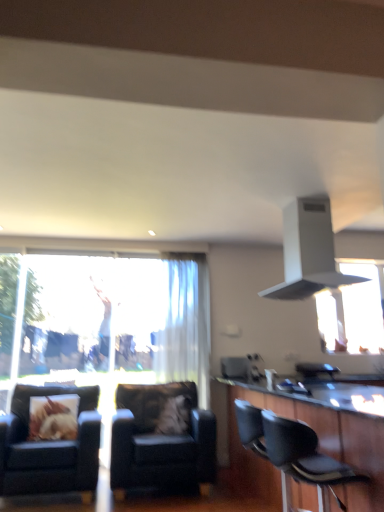
Image resolution: width=384 pixels, height=512 pixels. What are the coordinates of `white sheer curtain at center` in the screenshot? It's located at (186, 323).

In order to face fluffy fabric pillow at center, the second pillow from the left, should I rotate leftwards or rightwards?

Turn left by 2.016 degrees to look at fluffy fabric pillow at center, the second pillow from the left.

Image resolution: width=384 pixels, height=512 pixels. Identify the location of leather armchair at center, the 1th chair from the back. (161, 438).

Does point (37, 422) come farther from viewer compared to point (279, 426)?

Yes, point (37, 422) is farther from viewer.

Is printed fabric pillow at left, the second pillow positioned from the right, inside or outside of black leather chair at lower right, the first chair when ordered from front to back?

printed fabric pillow at left, the second pillow positioned from the right, is outside black leather chair at lower right, the first chair when ordered from front to back.

From the image's perspective, is printed fabric pillow at left, placed as the 1th pillow when sorted from left to right, on top of black leather chair at lower right, which is the first chair in right-to-left order?

Incorrect, from the image's perspective, printed fabric pillow at left, placed as the 1th pillow when sorted from left to right, is lower than black leather chair at lower right, which is the first chair in right-to-left order.

Considering the sizes of objects printed fabric pillow at left, placed as the 1th pillow when sorted from left to right, and white sheer curtain at center in the image provided, who is thinner, printed fabric pillow at left, placed as the 1th pillow when sorted from left to right, or white sheer curtain at center?

white sheer curtain at center is thinner.

Considering the points (47, 429) and (203, 382), which point is behind, point (47, 429) or point (203, 382)?

The point (203, 382) is farther from the camera.

From a real-world perspective, is printed fabric pillow at left, placed as the 1th pillow when sorted from left to right, above or below white sheer curtain at center?

Clearly, from a real-world perspective, printed fabric pillow at left, placed as the 1th pillow when sorted from left to right, is below white sheer curtain at center.

Is the depth of printed fabric pillow at left, placed as the 1th pillow when sorted from left to right, less than that of white sheer curtain at center?

Yes, it is in front of white sheer curtain at center.

Is white sheer curtain at center touching black leather chair at lower left, arranged as the 1th chair when viewed from the left?

No, white sheer curtain at center is not with black leather chair at lower left, arranged as the 1th chair when viewed from the left.

Based on the photo, who is taller, white sheer curtain at center or black leather chair at lower left, arranged as the 1th chair when viewed from the left?

white sheer curtain at center is taller.

Is white sheer curtain at center facing away from black leather chair at lower left, acting as the 2th chair starting from the back?

white sheer curtain at center is not turned away from black leather chair at lower left, acting as the 2th chair starting from the back.

Does point (188, 325) appear closer or farther from the camera than point (93, 436)?

Clearly, point (188, 325) is more distant from the camera than point (93, 436).

Considering the relative positions of fluffy fabric pillow at center, the 1th pillow positioned from the right, and printed fabric pillow at left, the second pillow positioned from the right, in the image provided, is fluffy fabric pillow at center, the 1th pillow positioned from the right, in front of printed fabric pillow at left, the second pillow positioned from the right,?

No, fluffy fabric pillow at center, the 1th pillow positioned from the right, is behind printed fabric pillow at left, the second pillow positioned from the right.

You are a GUI agent. You are given a task and a screenshot of the screen. Output one action in this format:
    pyautogui.click(x=<x>, y=<y>)
    Task: Click on the pillow below the fluffy fabric pillow at center, the 1th pillow positioned from the right (from a real-world perspective)
    
    Given the screenshot: What is the action you would take?
    pyautogui.click(x=53, y=417)

Considering the relative positions of fluffy fabric pillow at center, the second pillow from the left, and printed fabric pillow at left, placed as the 1th pillow when sorted from left to right, in the image provided, is fluffy fabric pillow at center, the second pillow from the left, to the left of printed fabric pillow at left, placed as the 1th pillow when sorted from left to right, from the viewer's perspective?

No, fluffy fabric pillow at center, the second pillow from the left, is not to the left of printed fabric pillow at left, placed as the 1th pillow when sorted from left to right.

From the image's perspective, does printed fabric pillow at left, placed as the 1th pillow when sorted from left to right, appear higher than white matte exhaust hood at upper center?

No, from the image's perspective, printed fabric pillow at left, placed as the 1th pillow when sorted from left to right, is not on top of white matte exhaust hood at upper center.

From a real-world perspective, does printed fabric pillow at left, placed as the 1th pillow when sorted from left to right, sit lower than white matte exhaust hood at upper center?

Yes, from a real-world perspective, printed fabric pillow at left, placed as the 1th pillow when sorted from left to right, is beneath white matte exhaust hood at upper center.

At what (x,y) coordinates should I click in order to perform the action: click on the 1st pillow behind when counting from the white matte exhaust hood at upper center. Please return your answer as a coordinate pair (x, y). The height and width of the screenshot is (512, 384). Looking at the image, I should click on (53, 417).

Consider the image. Between printed fabric pillow at left, placed as the 1th pillow when sorted from left to right, and white matte exhaust hood at upper center, which one has larger size?

white matte exhaust hood at upper center is bigger.

In the image, there is a black leather barstools at lower right. At what (x,y) coordinates should I click in order to perform the action: click on exhaust hood above it (from the image's perspective). Please return your answer as a coordinate pair (x, y). This screenshot has width=384, height=512. Looking at the image, I should click on (308, 251).

Is white matte exhaust hood at upper center facing towards black leather barstools at lower right?

No, white matte exhaust hood at upper center is not oriented towards black leather barstools at lower right.

Considering the relative sizes of white matte exhaust hood at upper center and black leather barstools at lower right in the image provided, is white matte exhaust hood at upper center shorter than black leather barstools at lower right?

Indeed, white matte exhaust hood at upper center has a lesser height compared to black leather barstools at lower right.

From the image's perspective, is white matte exhaust hood at upper center below black leather barstools at lower right?

No, from the image's perspective, white matte exhaust hood at upper center is not below black leather barstools at lower right.

From the image's perspective, is black leather chair at lower right, the first chair when ordered from front to back, located beneath fluffy fabric pillow at center, the 1th pillow positioned from the right?

No, from the image's perspective, black leather chair at lower right, the first chair when ordered from front to back, is not below fluffy fabric pillow at center, the 1th pillow positioned from the right.

Which is behind, black leather chair at lower right, which appears as the 3th chair when viewed from the left, or fluffy fabric pillow at center, the second pillow from the left?

fluffy fabric pillow at center, the second pillow from the left, is more distant.

Is black leather chair at lower right, which is the first chair in right-to-left order, not near fluffy fabric pillow at center, the second pillow from the left?

Yes, black leather chair at lower right, which is the first chair in right-to-left order, and fluffy fabric pillow at center, the second pillow from the left, are quite far apart.

Could you tell me if black leather chair at lower right, the first chair when ordered from front to back, is facing fluffy fabric pillow at center, the second pillow from the left?

No, black leather chair at lower right, the first chair when ordered from front to back, is not facing towards fluffy fabric pillow at center, the second pillow from the left.

You are a GUI agent. You are given a task and a screenshot of the screen. Output one action in this format:
    pyautogui.click(x=<x>, y=<y>)
    Task: Click on the chair above the printed fabric pillow at left, placed as the 1th pillow when sorted from left to right (from a real-world perspective)
    Image resolution: width=384 pixels, height=512 pixels.
    Given the screenshot: What is the action you would take?
    pyautogui.click(x=304, y=460)

Identify the location of pillow that is the 2nd object to the left of the white sheer curtain at center, starting at the anchor. Image resolution: width=384 pixels, height=512 pixels. (53, 417).

Looking at this image, considering their positions, is black leather chair at lower right, arranged as the 3th chair when viewed from the back, positioned closer to white sheer curtain at center than white matte exhaust hood at upper center?

white matte exhaust hood at upper center.

From the image, which object appears to be farther from printed fabric pillow at left, placed as the 1th pillow when sorted from left to right, black leather barstools at lower right or white sheer curtain at center?

The object further to printed fabric pillow at left, placed as the 1th pillow when sorted from left to right, is black leather barstools at lower right.

From the image, which object appears to be nearer to white sheer curtain at center, black leather barstools at lower right or black leather chair at lower right, arranged as the 3th chair when viewed from the back?

black leather barstools at lower right is positioned closer to the anchor white sheer curtain at center.

From the picture: Considering their positions, is leather armchair at center, marked as the second chair in a right-to-left arrangement, positioned further to black leather chair at lower left, arranged as the 1th chair when viewed from the left, than black leather chair at lower right, which appears as the 3th chair when viewed from the left?

Among the two, black leather chair at lower right, which appears as the 3th chair when viewed from the left, is located further to black leather chair at lower left, arranged as the 1th chair when viewed from the left.

Considering their positions, is white matte exhaust hood at upper center positioned closer to black leather chair at lower right, arranged as the 3th chair when viewed from the back, than fluffy fabric pillow at center, the 1th pillow positioned from the right?

The object closer to black leather chair at lower right, arranged as the 3th chair when viewed from the back, is white matte exhaust hood at upper center.

Estimate the real-world distances between objects in this image. Which object is closer to leather armchair at center, the 1th chair from the back, black leather barstools at lower right or white sheer curtain at center?

white sheer curtain at center.

Which object lies further to the anchor point fluffy fabric pillow at center, the 1th pillow positioned from the right, black leather chair at lower left, which is the second chair from front to back, or black leather barstools at lower right?

Based on the image, black leather barstools at lower right appears to be further to fluffy fabric pillow at center, the 1th pillow positioned from the right.

From the image, which object appears to be nearer to black leather chair at lower right, which appears as the 3th chair when viewed from the left, white sheer curtain at center or printed fabric pillow at left, the second pillow positioned from the right?

Among the two, printed fabric pillow at left, the second pillow positioned from the right, is located nearer to black leather chair at lower right, which appears as the 3th chair when viewed from the left.

You are a GUI agent. You are given a task and a screenshot of the screen. Output one action in this format:
    pyautogui.click(x=<x>, y=<y>)
    Task: Click on the exhaust hood between black leather chair at lower right, which appears as the 3th chair when viewed from the left, and white sheer curtain at center from front to back
    
    Given the screenshot: What is the action you would take?
    pyautogui.click(x=308, y=251)

Find the location of a particular element. The image size is (384, 512). chair between black leather chair at lower left, which is the second chair from front to back, and black leather chair at lower right, which is the first chair in right-to-left order, in the horizontal direction is located at coordinates (161, 438).

The height and width of the screenshot is (512, 384). I want to click on chair between white matte exhaust hood at upper center and black leather barstools at lower right in the vertical direction, so [x=304, y=460].

Locate an element on the screen. curtain between white matte exhaust hood at upper center and leather armchair at center, the 1th chair from the back, vertically is located at coordinates (186, 323).